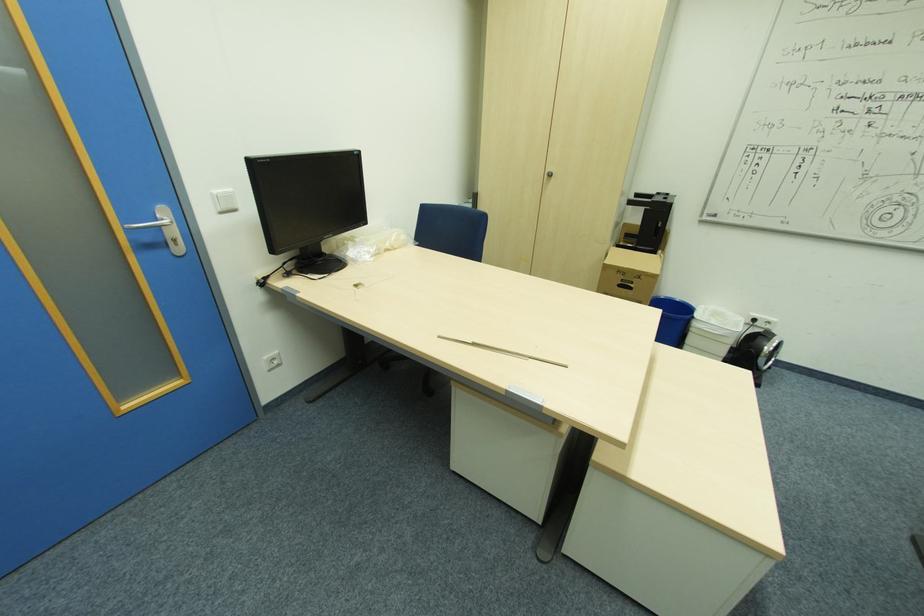
Where would you push the white light switch? Please return your answer as a coordinate pair (x, y).

(225, 201)